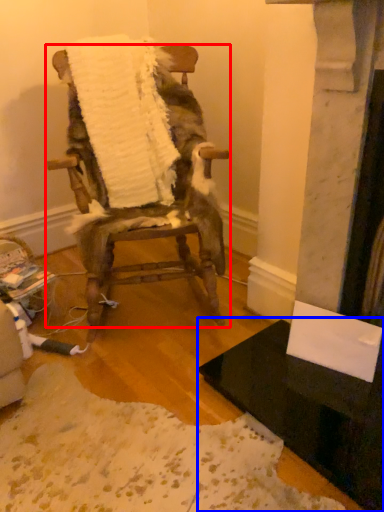
Question: Which of the following is the closest to the observer, chair (highlighted by a red box) or table (highlighted by a blue box)?

Choices:
 (A) chair
 (B) table

Answer: (B)